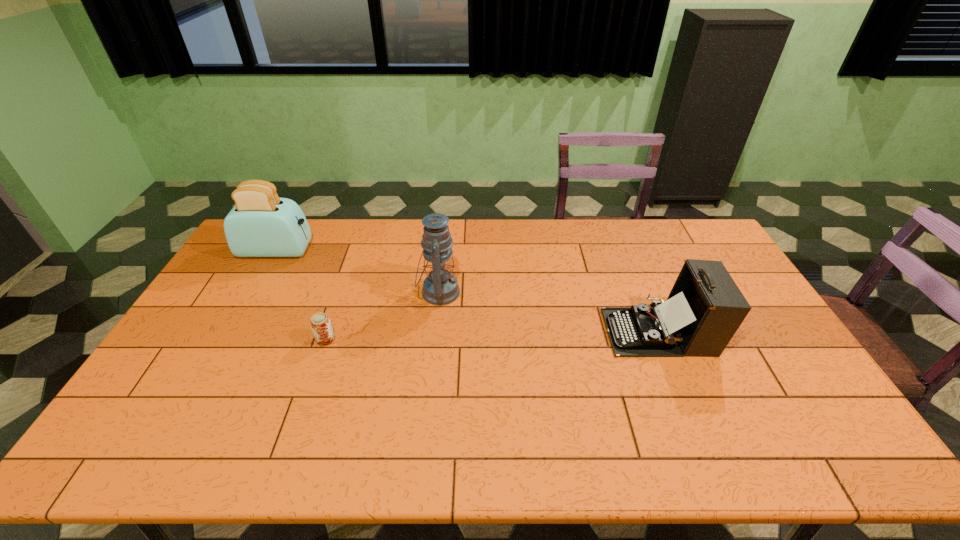
Identify the location of the third object from left to right. The width and height of the screenshot is (960, 540). (440, 287).

Find the location of `toaster`. toaster is located at coordinates (261, 224).

Find the location of a particular element. The image size is (960, 540). the leftmost object is located at coordinates (261, 224).

Image resolution: width=960 pixels, height=540 pixels. In order to click on typewriter in this screenshot , I will do `click(705, 308)`.

Where is `the rightmost object`? the rightmost object is located at coordinates (705, 308).

Identify the location of the shortest object. (320, 323).

Locate an element on the screen. beer can is located at coordinates (320, 323).

Where is `free space located on the front-facing side of the lantern`? This screenshot has width=960, height=540. free space located on the front-facing side of the lantern is located at coordinates 488,292.

Identify the location of vacant region located on the side of the farthest object with the lever. (334, 251).

Locate an element on the screen. The width and height of the screenshot is (960, 540). vacant space located 0.350m inside the open case of the rightmost object is located at coordinates (489, 332).